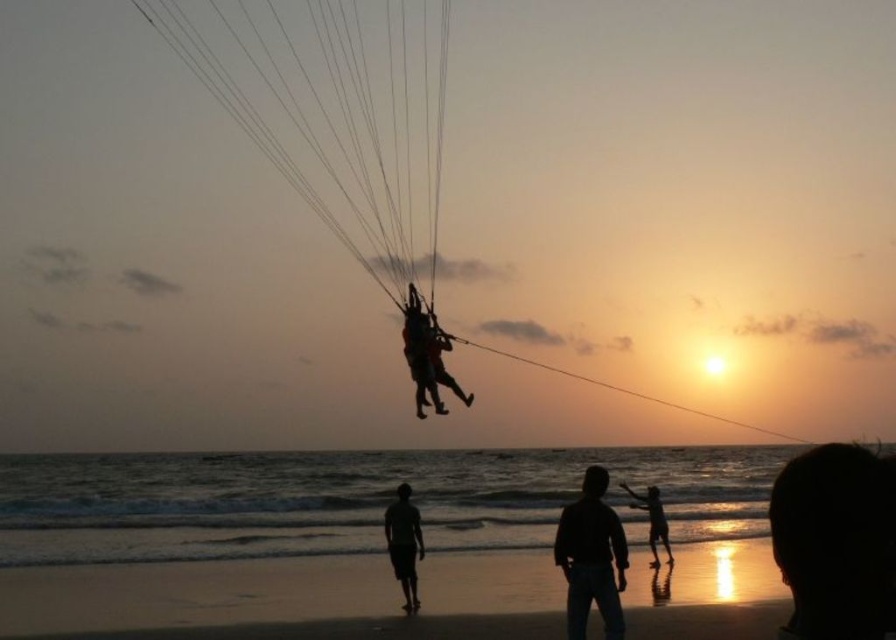
Question: Is sandy beach at lower center closer to the viewer compared to silhouette jeans at lower center?

Choices:
 (A) no
 (B) yes

Answer: (A)

Question: Is silhouette sand at lower center closer to the viewer compared to silhouette sand at lower right?

Choices:
 (A) yes
 (B) no

Answer: (A)

Question: Which object is farther from the camera taking this photo?

Choices:
 (A) silhouette sand at lower right
 (B) sandy beach at lower center
 (C) silhouette sand at lower center

Answer: (A)

Question: Which point is closer to the camera?

Choices:
 (A) silhouette sand at lower right
 (B) sandy beach at lower center
 (C) silhouette jeans at lower center
 (D) silhouette sand at lower center

Answer: (C)

Question: Does sandy beach at lower center have a larger size compared to silhouette sand at lower center?

Choices:
 (A) yes
 (B) no

Answer: (A)

Question: Which point appears farthest from the camera in this image?

Choices:
 (A) (128, 568)
 (B) (389, 513)
 (C) (651, 508)
 (D) (566, 572)

Answer: (C)